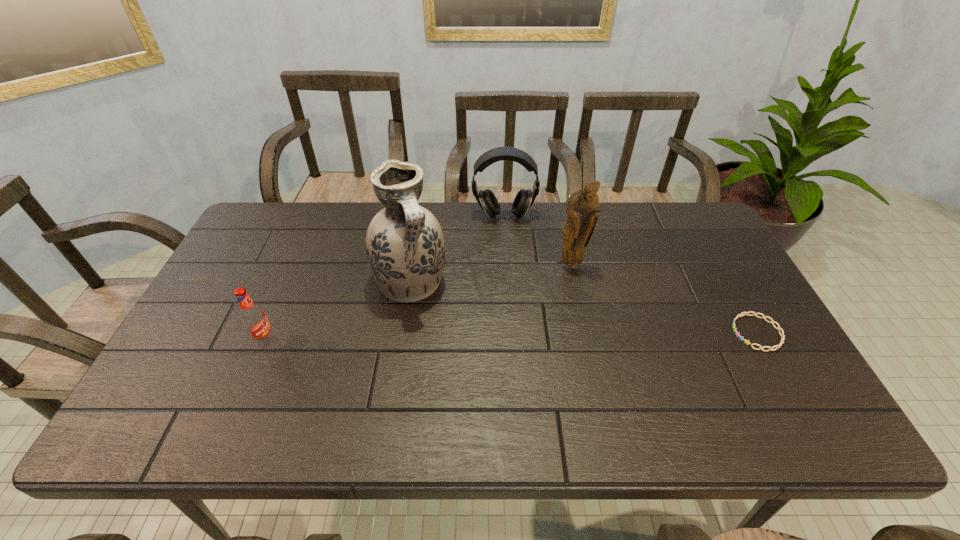
Where is `free space located on the front-facing side of the fourth object from left to right`? Image resolution: width=960 pixels, height=540 pixels. free space located on the front-facing side of the fourth object from left to right is located at coordinates (573, 307).

Find the location of `free space located 0.190m on the front-facing side of the fourth object from left to right`. free space located 0.190m on the front-facing side of the fourth object from left to right is located at coordinates (574, 321).

Where is `free space located on the front-facing side of the fourth object from left to right`? The height and width of the screenshot is (540, 960). free space located on the front-facing side of the fourth object from left to right is located at coordinates (577, 380).

The width and height of the screenshot is (960, 540). I want to click on object at the far edge, so click(x=524, y=199).

You are a GUI agent. You are given a task and a screenshot of the screen. Output one action in this format:
    pyautogui.click(x=<x>, y=<y>)
    Task: Click on the object positioned at the right edge
    
    Given the screenshot: What is the action you would take?
    pyautogui.click(x=778, y=328)

What are the coordinates of `vacant region at the far edge of the desktop` in the screenshot? It's located at (517, 227).

Identify the location of free space at the near edge. (358, 397).

Where is `blank area at the right edge`? The height and width of the screenshot is (540, 960). blank area at the right edge is located at coordinates (749, 321).

You are a GUI agent. You are given a task and a screenshot of the screen. Output one action in this format:
    pyautogui.click(x=<x>, y=<y>)
    Task: Click on the vacant space at the far left corner of the desktop
    The width and height of the screenshot is (960, 540).
    Given the screenshot: What is the action you would take?
    (x=267, y=204)

The width and height of the screenshot is (960, 540). Find the location of `vacant space at the far right corner`. vacant space at the far right corner is located at coordinates (707, 221).